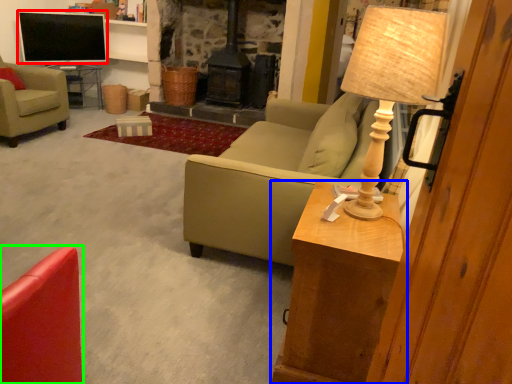
Question: Which object is positioned closest to television (highlighted by a red box)? Select from table (highlighted by a blue box) and chair (highlighted by a green box).

Choices:
 (A) table
 (B) chair

Answer: (A)